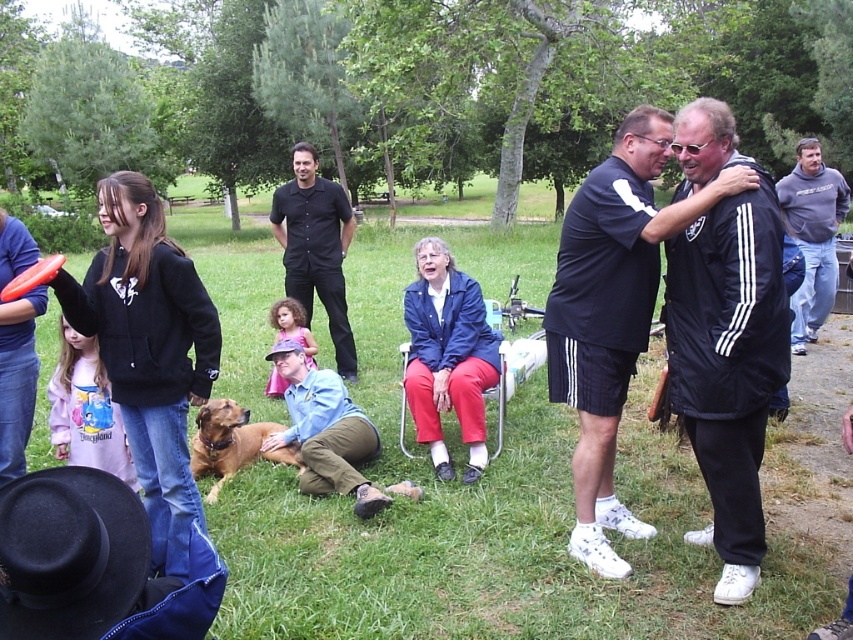
Between black smooth shirt at center and orange matte frisbee at left, which one is positioned lower?

black smooth shirt at center is below.

Does black smooth shirt at center have a smaller size compared to orange matte frisbee at left?

Correct, black smooth shirt at center occupies less space than orange matte frisbee at left.

Between point (343, 376) and point (45, 268), which one is positioned behind?

Positioned behind is point (343, 376).

Where is `black smooth shirt at center`? black smooth shirt at center is located at coordinates (315, 248).

Is gray fleece hoodie at upper right smaller than brown furry dog at lower left?

Correct, gray fleece hoodie at upper right occupies less space than brown furry dog at lower left.

Which is more to the left, gray fleece hoodie at upper right or brown furry dog at lower left?

Positioned to the left is brown furry dog at lower left.

You are a GUI agent. You are given a task and a screenshot of the screen. Output one action in this format:
    pyautogui.click(x=<x>, y=<y>)
    Task: Click on the gray fleece hoodie at upper right
    This screenshot has height=640, width=853.
    Given the screenshot: What is the action you would take?
    pyautogui.click(x=811, y=236)

Identify the location of gray fleece hoodie at upper right. (811, 236).

Is point (724, 115) farther from viewer compared to point (444, 298)?

No, it is not.

Between point (691, 161) and point (473, 285), which one is positioned behind?

Positioned behind is point (473, 285).

What do you see at coordinates (724, 337) in the screenshot?
I see `black adidas tracksuit at center` at bounding box center [724, 337].

Identify the location of black adidas tracksuit at center. This screenshot has height=640, width=853. (724, 337).